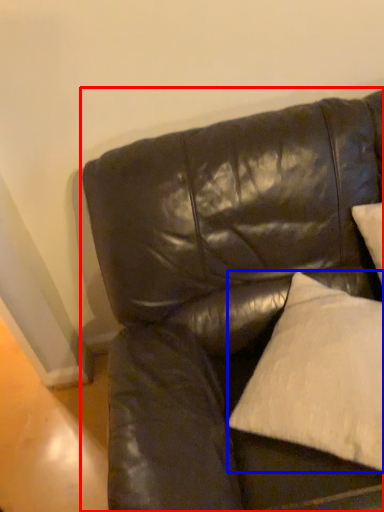
Question: Among these objects, which one is nearest to the camera, studio couch (highlighted by a red box) or pillow (highlighted by a blue box)?

Choices:
 (A) studio couch
 (B) pillow

Answer: (A)